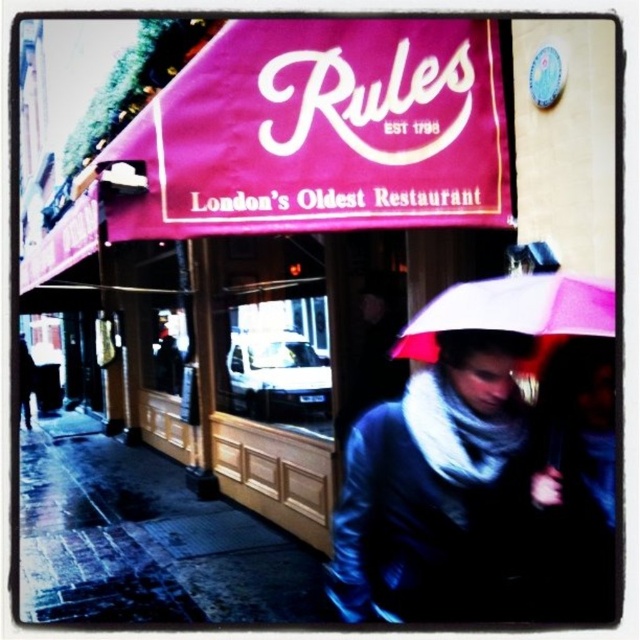
Who is more forward, (442,337) or (516,312)?

Positioned in front is point (516,312).

Can you confirm if matte black jacket at center is bigger than pink matte umbrella at lower center?

Incorrect, matte black jacket at center is not larger than pink matte umbrella at lower center.

Does point (433, 518) come closer to viewer compared to point (502, 276)?

That is True.

This screenshot has height=640, width=640. I want to click on matte black jacket at center, so click(436, 490).

Between matte black jacket at center and wet asphalt at lower left, which one is positioned higher?

Positioned higher is matte black jacket at center.

Can you confirm if matte black jacket at center is thinner than wet asphalt at lower left?

Incorrect, matte black jacket at center's width is not less than wet asphalt at lower left's.

Is point (454, 484) closer to viewer compared to point (42, 518)?

Yes, it is in front of point (42, 518).

Locate an element on the screen. The image size is (640, 640). matte black jacket at center is located at coordinates (436, 490).

Is wet asphalt at lower left shorter than pink matte umbrella at lower center?

Yes, wet asphalt at lower left is shorter than pink matte umbrella at lower center.

In the scene shown: Between wet asphalt at lower left and pink matte umbrella at lower center, which one is positioned lower?

wet asphalt at lower left is lower down.

Who is more forward, (83, 435) or (538, 323)?

Point (538, 323)

Identify the location of wet asphalt at lower left. (147, 540).